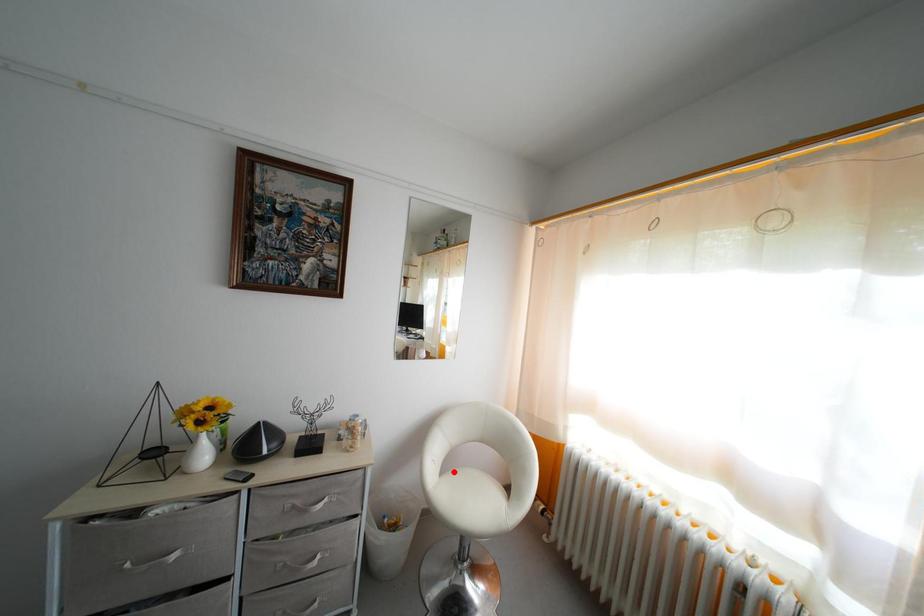
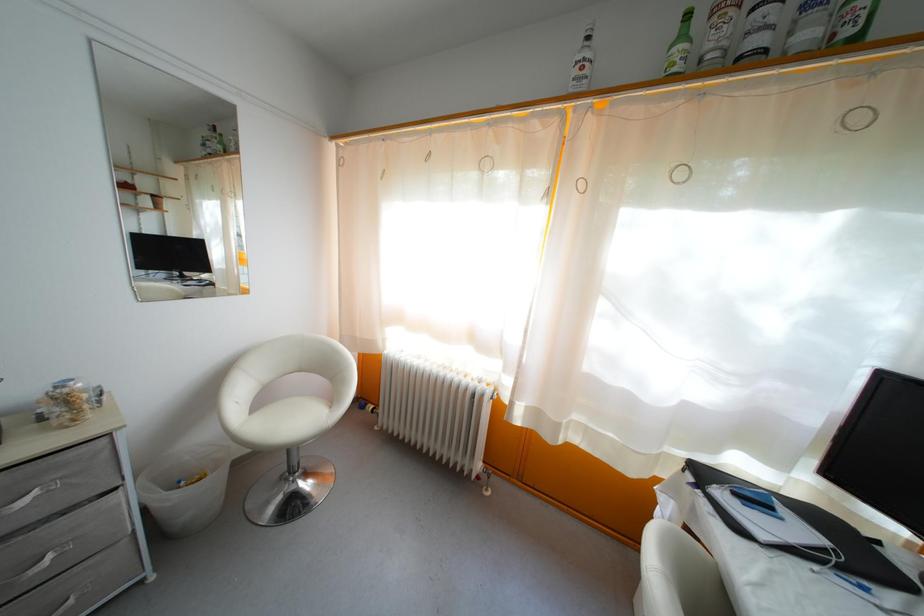
Question: I am providing you with two images of the same scene from different viewpoints. In image1, a red point is highlighted. Considering the same 3D point in image2, which of the following is correct?

Choices:
 (A) It is closer
 (B) It is farther

Answer: (B)